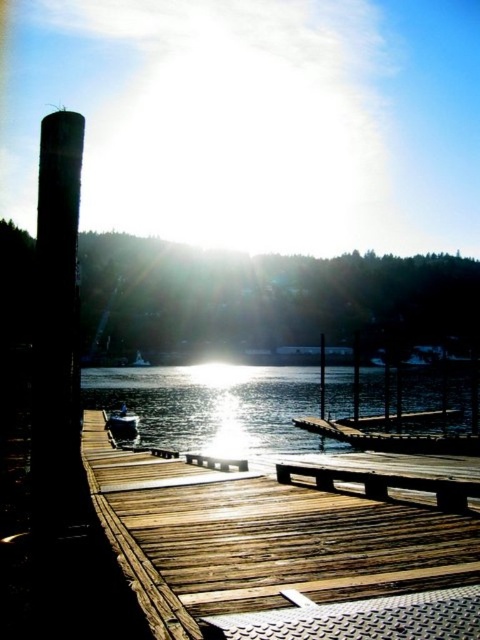
You are planning to set up a small gathering on the wooden dock at center and the wooden picnic table at center. Which of these two areas can accommodate more people comfortably?

The wooden dock at center is bigger than the wooden picnic table at center, so it can accommodate more people comfortably.

From the picture: You are standing on the dock and see two points marked in the image. Which point is closer to you, point at (352, 476) or point at (123, 424)?

Point at (352, 476) is in front of point at (123, 424), so it is closer to you.